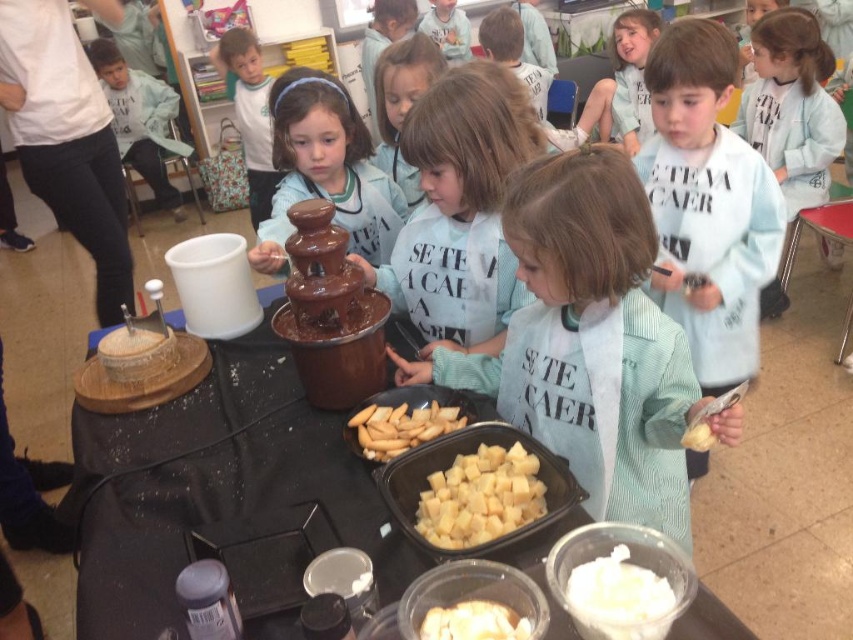
Question: Considering the relative positions of light blue apron at center and matte chocolate fountain at center in the image provided, where is light blue apron at center located with respect to matte chocolate fountain at center?

Choices:
 (A) right
 (B) left

Answer: (A)

Question: Is matte blue shirt at center bigger than yellow crumbly cheese at center?

Choices:
 (A) no
 (B) yes

Answer: (B)

Question: Which point appears closest to the camera in this image?

Choices:
 (A) (357, 435)
 (B) (445, 605)
 (C) (352, 234)
 (D) (402, 243)

Answer: (B)

Question: Which object is closer to the camera taking this photo?

Choices:
 (A) matte chocolate fountain at center
 (B) white creamy chunks at center

Answer: (B)

Question: Does white creamy whipped topping at center come behind yellow crumbly at center?

Choices:
 (A) yes
 (B) no

Answer: (B)

Question: Estimate the real-world distances between objects in this image. Which object is closer to the yellow crumbly cheese at center?

Choices:
 (A) light blue fabric shirt at center
 (B) white creamy whipped topping at center
 (C) matte blue shirt at center

Answer: (B)